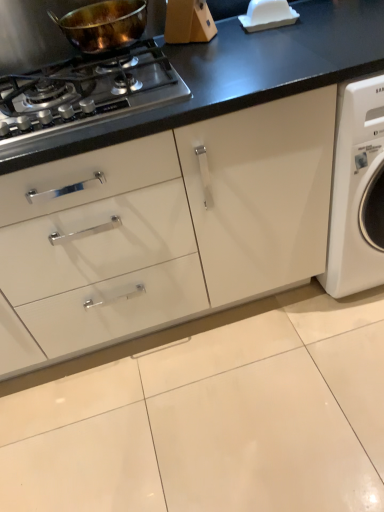
Question: Is shiny copper pan at upper left bigger or smaller than shiny metallic gas stove at upper left?

Choices:
 (A) big
 (B) small

Answer: (B)

Question: In the image, is shiny copper pan at upper left on the left side or the right side of shiny metallic gas stove at upper left?

Choices:
 (A) left
 (B) right

Answer: (B)

Question: Considering the positions of shiny copper pan at upper left and shiny metallic gas stove at upper left in the image, is shiny copper pan at upper left taller or shorter than shiny metallic gas stove at upper left?

Choices:
 (A) tall
 (B) short

Answer: (A)

Question: From a real-world perspective, is shiny metallic gas stove at upper left physically located above or below shiny copper pan at upper left?

Choices:
 (A) below
 (B) above

Answer: (A)

Question: In the image, is shiny metallic gas stove at upper left on the left side or the right side of shiny copper pan at upper left?

Choices:
 (A) right
 (B) left

Answer: (B)

Question: Looking at the image, does shiny metallic gas stove at upper left seem bigger or smaller compared to shiny copper pan at upper left?

Choices:
 (A) small
 (B) big

Answer: (B)

Question: From their relative heights in the image, would you say shiny metallic gas stove at upper left is taller or shorter than shiny copper pan at upper left?

Choices:
 (A) tall
 (B) short

Answer: (B)